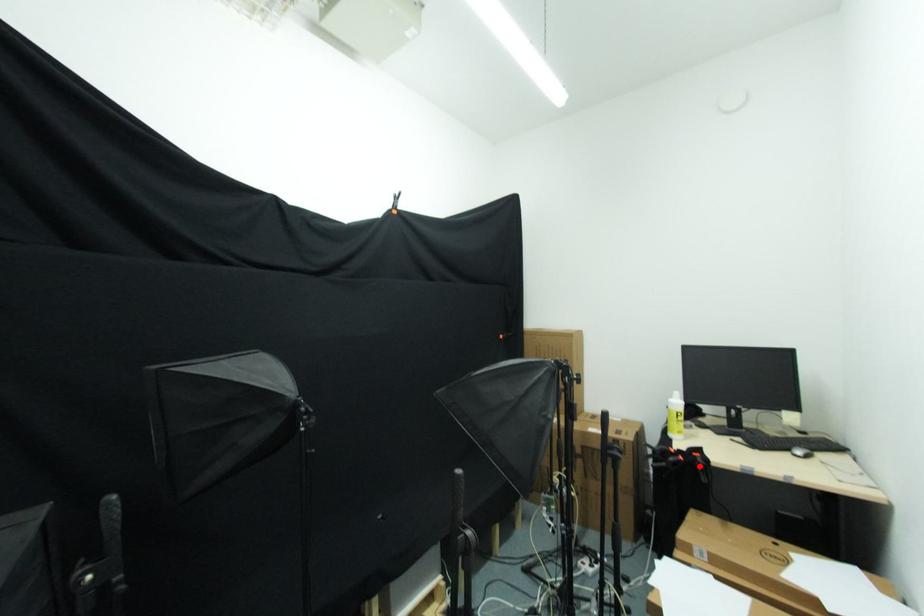
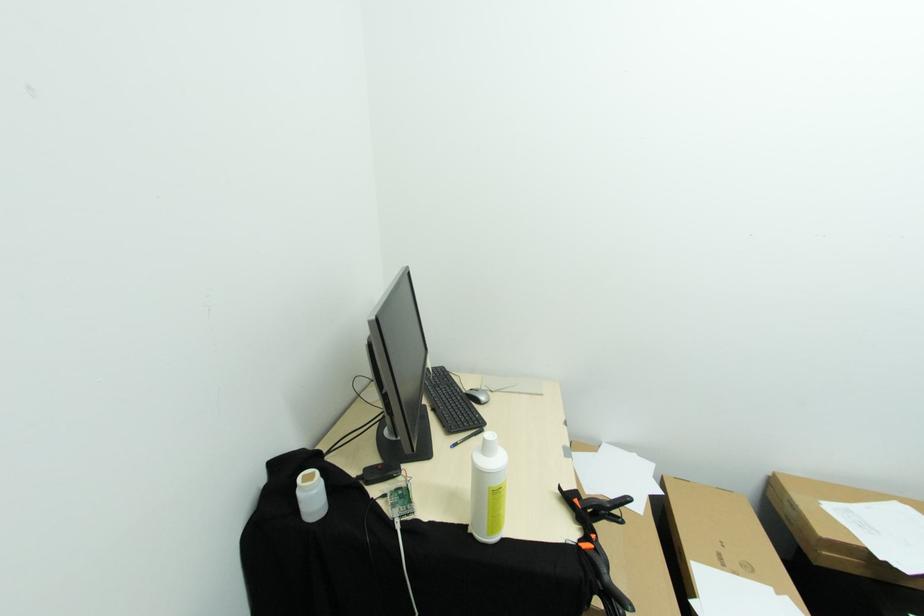
In the second image, find the point that corresponds to the highlighted location in the first image.

(604, 515)